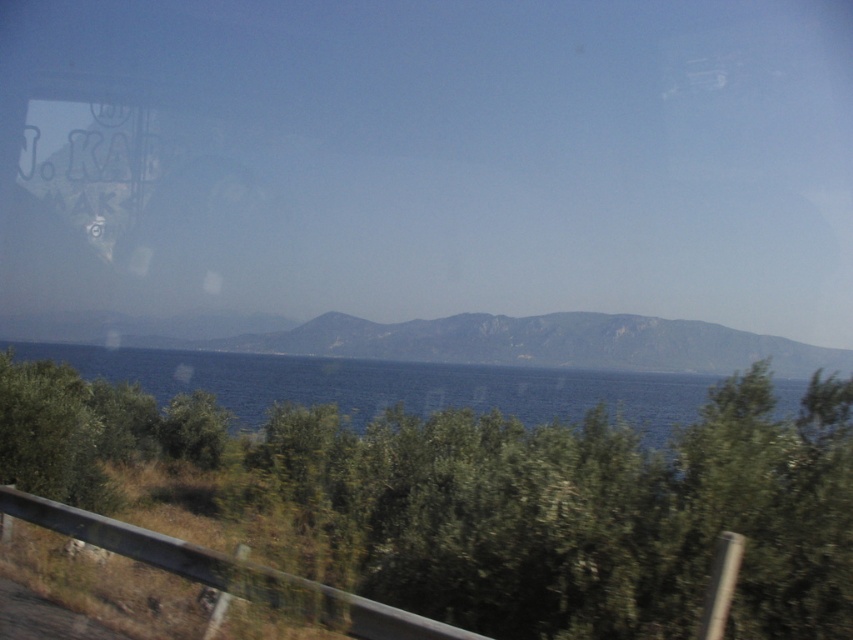
Which is behind, point (450, 550) or point (235, 397)?

The point (235, 397) is behind.

Who is lower down, green leafy tree at lower center or blue water at center?

Positioned lower is blue water at center.

Does point (532, 481) lie in front of point (88, 365)?

Yes, it is.

At what (x,y) coordinates should I click in order to perform the action: click on green leafy tree at lower center. Please return your answer as a coordinate pair (x, y). Looking at the image, I should click on (496, 500).

Image resolution: width=853 pixels, height=640 pixels. Describe the element at coordinates (459, 340) in the screenshot. I see `green rocky mountain at center` at that location.

Can you confirm if green rocky mountain at center is thinner than blue water at center?

Incorrect, green rocky mountain at center's width is not less than blue water at center's.

Is point (328, 330) farther from viewer compared to point (618, 385)?

That is True.

The height and width of the screenshot is (640, 853). In order to click on green rocky mountain at center in this screenshot , I will do coord(459,340).

Who is positioned more to the right, green leafy tree at lower center or green rocky mountain at center?

green rocky mountain at center is more to the right.

The image size is (853, 640). I want to click on green leafy tree at lower center, so click(x=496, y=500).

Identify the location of green leafy tree at lower center. (496, 500).